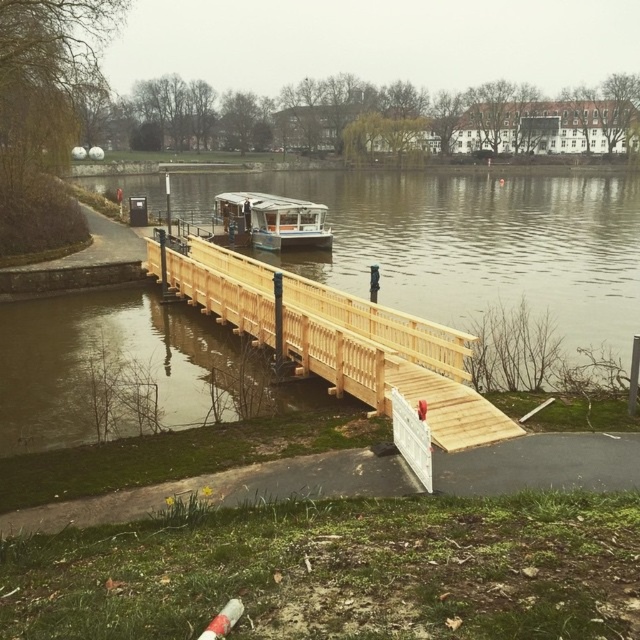
Question: Where is brown wooden bridge at center located in relation to natural wood bridge at center in the image?

Choices:
 (A) above
 (B) below

Answer: (A)

Question: Which is nearer to the brown wooden bridge at center?

Choices:
 (A) green plastic boat at center
 (B) natural wood bridge at center

Answer: (A)

Question: From the image, what is the correct spatial relationship of brown wooden bridge at center in relation to natural wood bridge at center?

Choices:
 (A) below
 (B) above

Answer: (B)

Question: Which of the following is the farthest from the observer?

Choices:
 (A) natural wood bridge at center
 (B) brown wooden bridge at center
 (C) green plastic boat at center

Answer: (C)

Question: Is natural wood bridge at center positioned behind green plastic boat at center?

Choices:
 (A) no
 (B) yes

Answer: (A)

Question: Based on their relative distances, which object is farther from the natural wood bridge at center?

Choices:
 (A) green plastic boat at center
 (B) brown wooden bridge at center

Answer: (B)